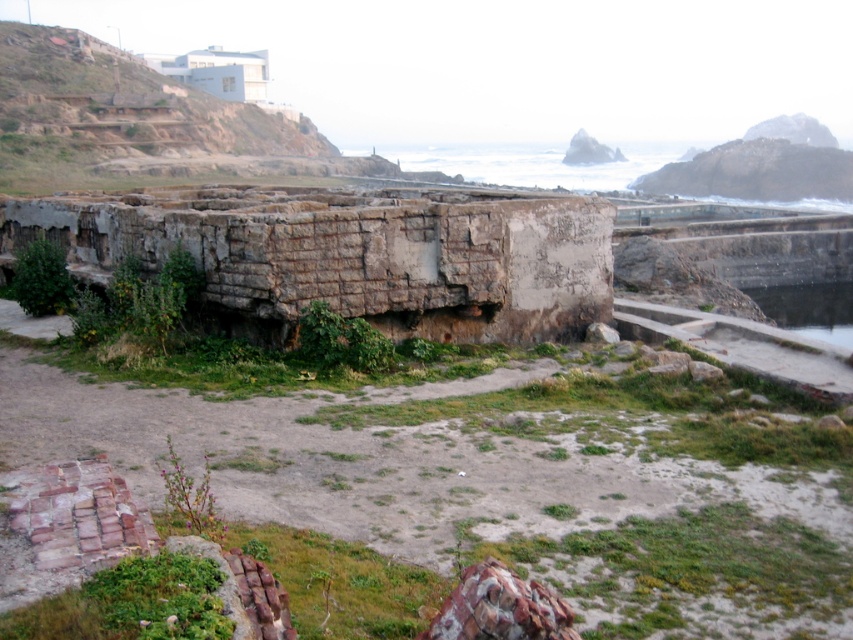
Is rusty concrete ruins at center above clear water at lower right?

Yes, rusty concrete ruins at center is above clear water at lower right.

Between point (227, 317) and point (831, 282), which one is positioned behind?

The point (831, 282) is more distant.

Locate an element on the screen. rusty concrete ruins at center is located at coordinates (349, 253).